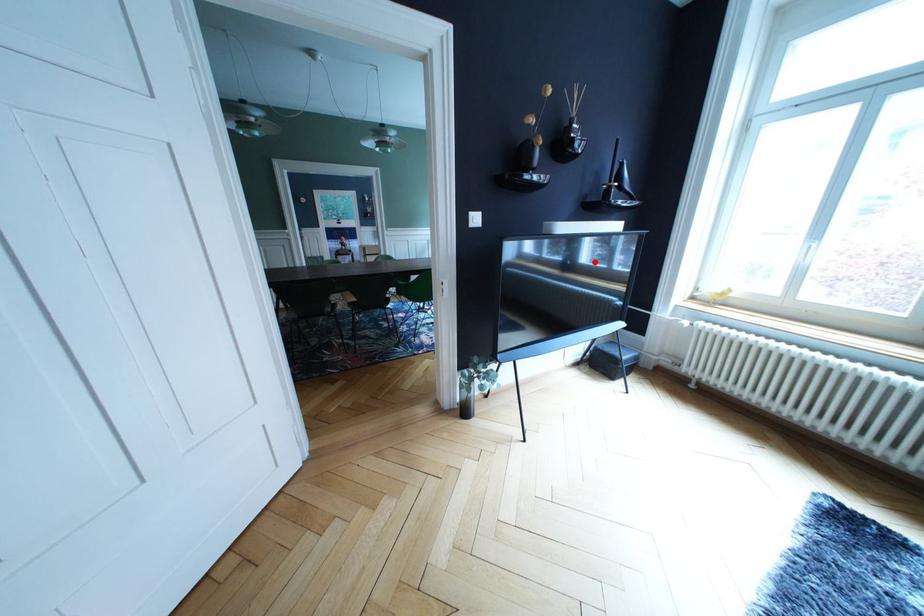
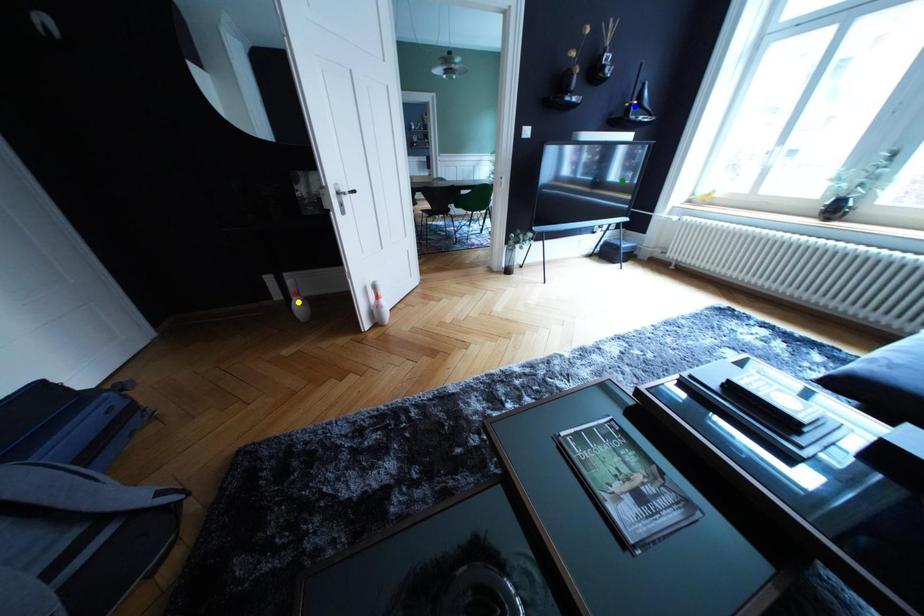
Question: I am providing you with two images of the same scene from different viewpoints. A red point is marked on the first image. You are given multiple points on the second image. In image 2, which mark is for the same physical point as the one in image 1?

Choices:
 (A) blue point
 (B) yellow point
 (C) green point

Answer: (C)